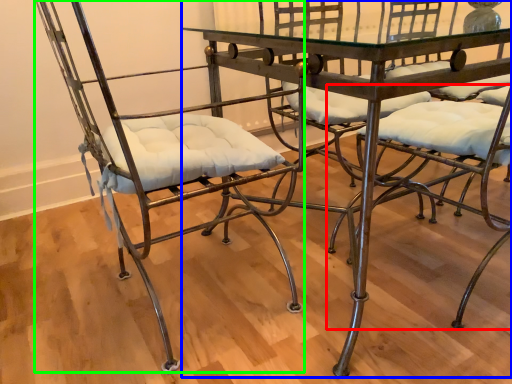
Question: Based on their relative distances, which object is farther from chair (highlighted by a red box)? Choose from table (highlighted by a blue box) and chair (highlighted by a green box).

Choices:
 (A) table
 (B) chair

Answer: (B)